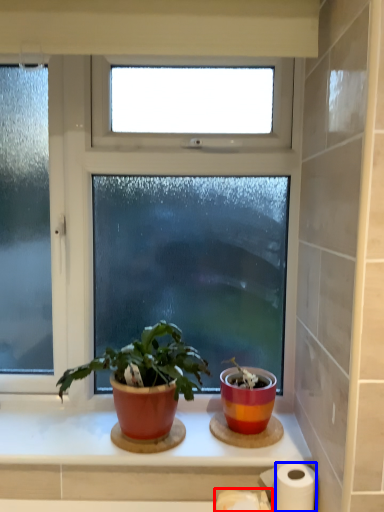
Question: Which of the following is the closest to the observer, toilet paper (highlighted by a red box) or paper towel (highlighted by a blue box)?

Choices:
 (A) toilet paper
 (B) paper towel

Answer: (A)